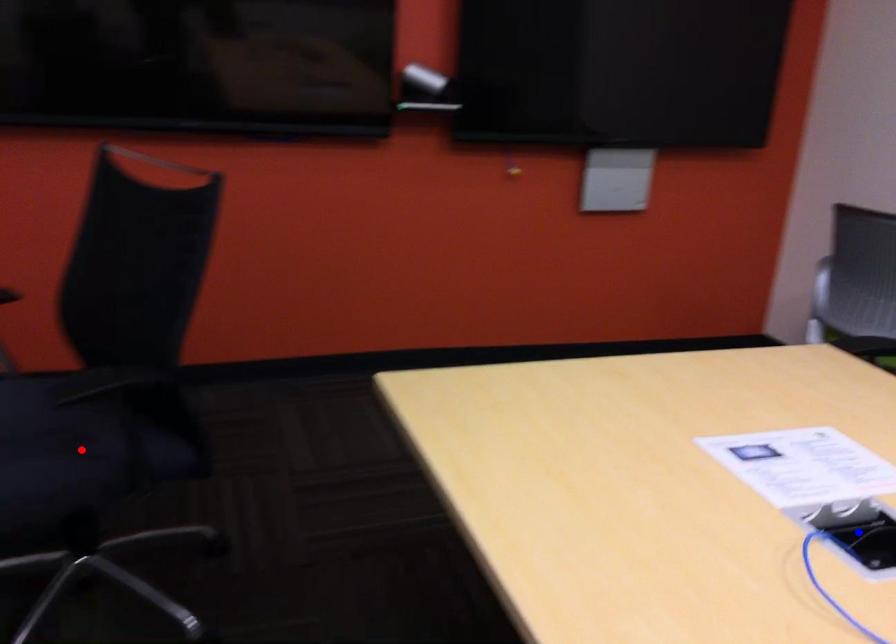
Question: In the image, two points are highlighted. Which point is nearer to the camera? Reply with the corresponding letter.

Choices:
 (A) blue point
 (B) red point

Answer: (A)